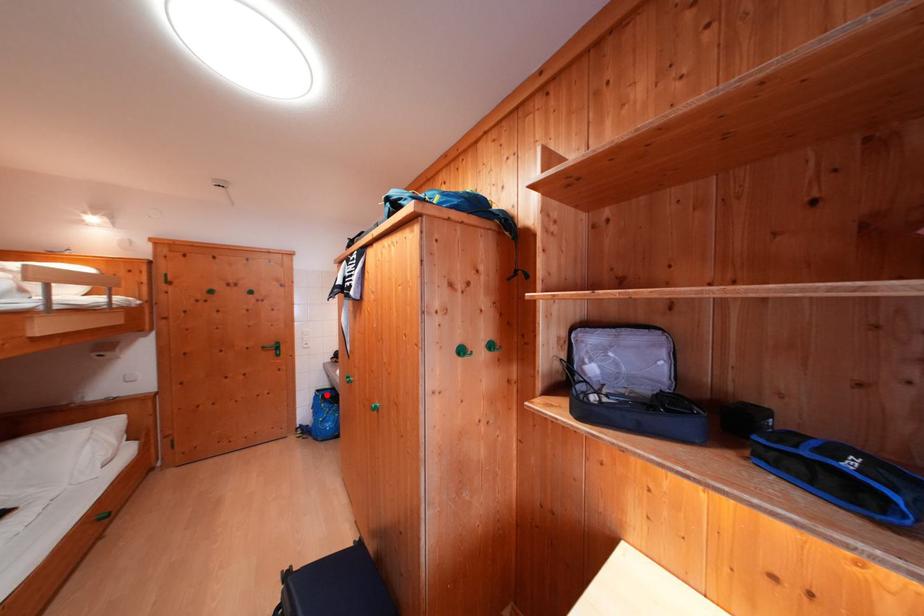
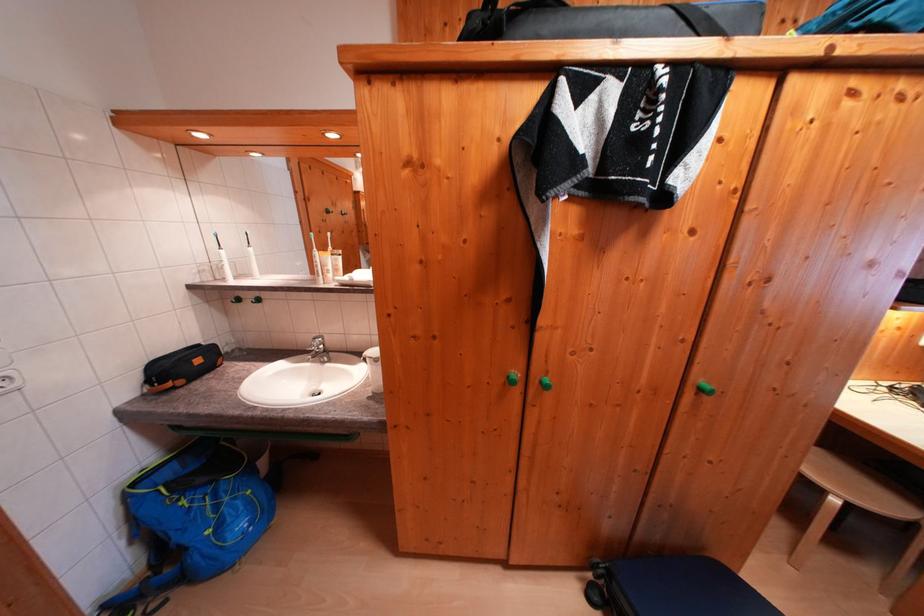
Where in the second image is the point corresponding to the highlighted location from the first image?

(142, 488)